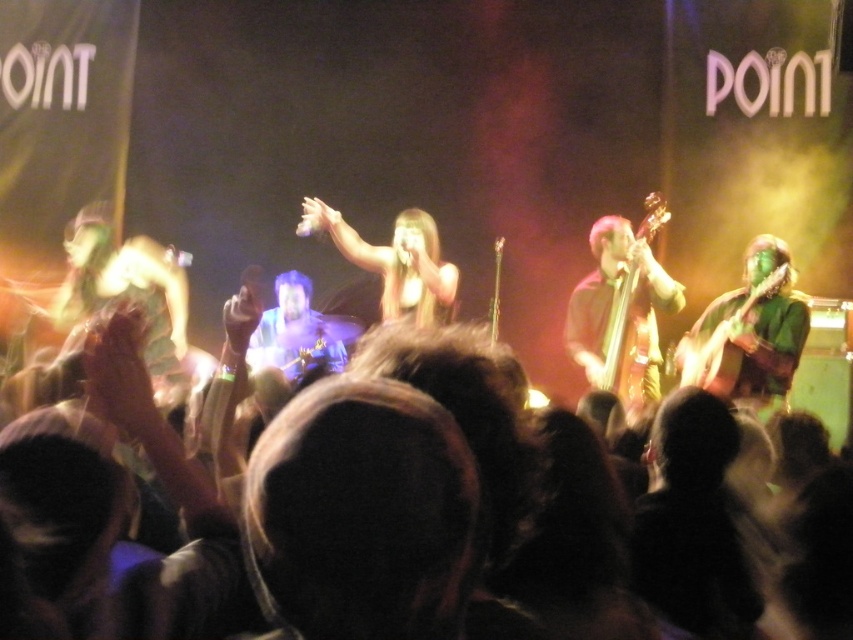
You are a stagehand who needs to place a tall stand between the wooden electric bass at center right and the green matte guitar at right. Which instrument should the stand be placed closer to to accommodate their heights?

The wooden electric bass at center right has a greater height compared to the green matte guitar at right, so the stand should be placed closer to the green matte guitar at right to ensure there is enough space for the taller bass.

You are a stagehand who needs to move a 4 feet long equipment case from the shiny gold microphone at center to the wooden electric bass at center right. Can you move it without tilting the case sideways?

The distance between the shiny gold microphone at center and the wooden electric bass at center right is 3.93 feet. Since the equipment case is 4 feet long, it is slightly longer than the available space. Therefore, you cannot move it without tilting the case sideways.

You are a photographer at the concert and want to capture a photo of both the shiny gold microphone at center and the green matte guitar at right. From the audience perspective, which object should you aim your camera to the left of to include both in the frame?

The shiny gold microphone at center is to the left of the green matte guitar at right. To include both in the frame, aim your camera towards the shiny gold microphone at center first, then ensure the green matte guitar at right is positioned to its right side in the shot.